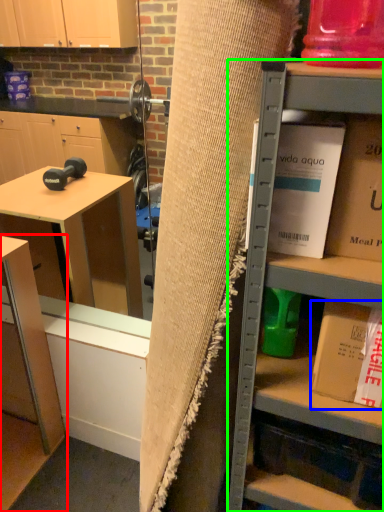
Question: Considering the real-world distances, which object is farthest from table (highlighted by a red box)? book (highlighted by a blue box) or shelf (highlighted by a green box)?

Choices:
 (A) book
 (B) shelf

Answer: (A)